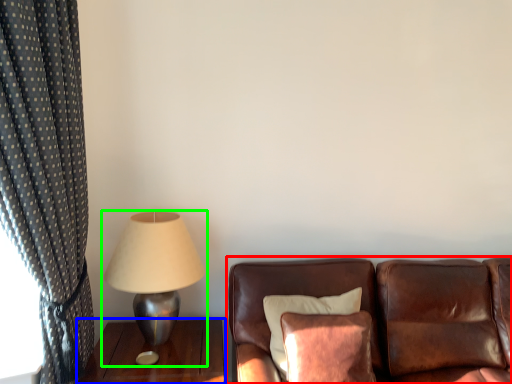
Question: Which is farther away from studio couch (highlighted by a red box)? table (highlighted by a blue box) or lamp (highlighted by a green box)?

Choices:
 (A) table
 (B) lamp

Answer: (B)